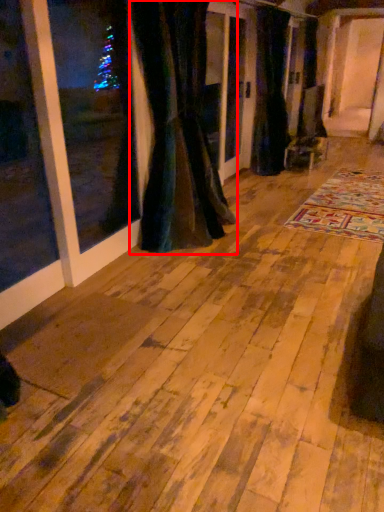
Question: Observing the image, what is the correct spatial positioning of curtain (annotated by the red box) in reference to curtain?

Choices:
 (A) left
 (B) right

Answer: (A)